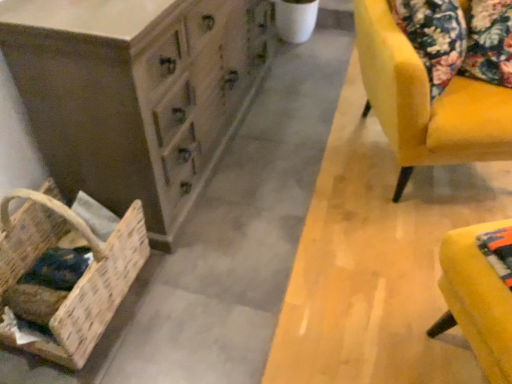
Find the location of a particular element. vacant space to the left of yellow fabric ottoman at lower right is located at coordinates (361, 325).